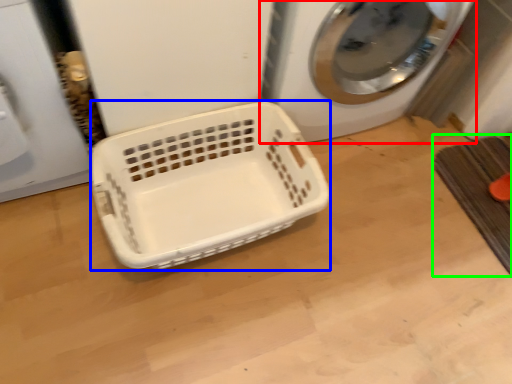
Question: Considering the real-world distances, which object is closest to washing machine (highlighted by a red box)? basket (highlighted by a blue box) or bath mat (highlighted by a green box).

Choices:
 (A) basket
 (B) bath mat

Answer: (A)